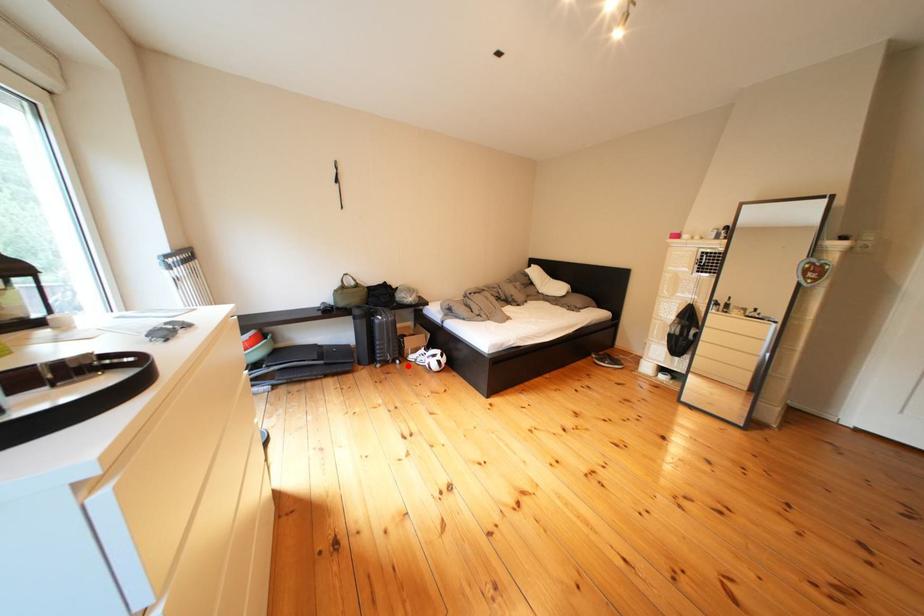
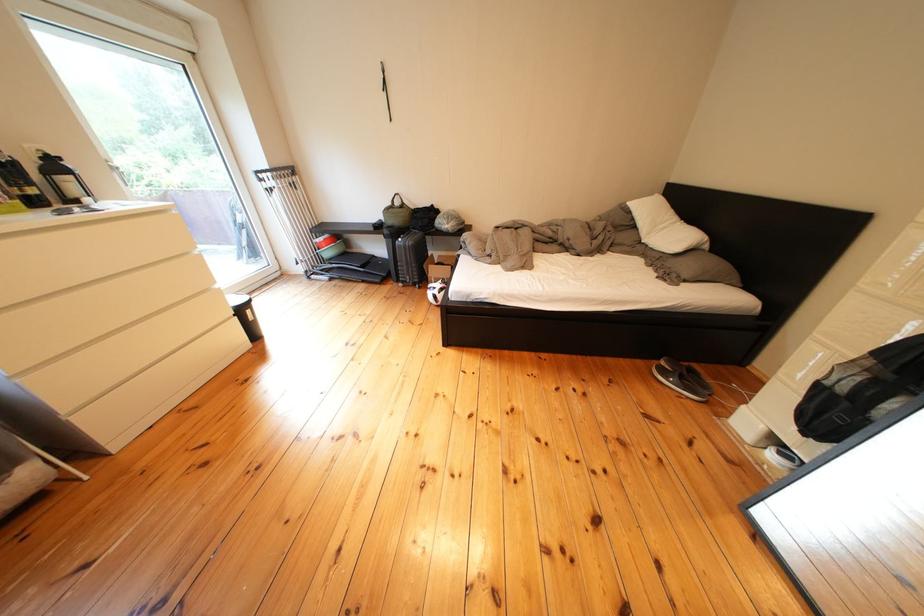
Question: I am providing you with two images of the same scene from different viewpoints. Image1 has a red point marked. In image2, the corresponding 3D location appears at what relative position? Reply with the corresponding letter.

Choices:
 (A) Closer
 (B) Farther

Answer: (B)